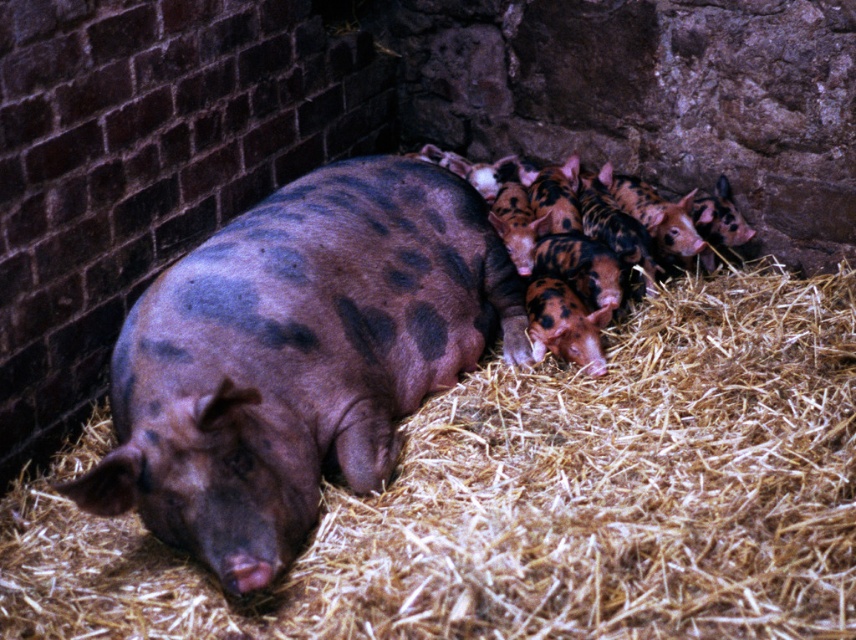
Does brown straw at center lie behind speckled brown pig at center?

No, brown straw at center is in front of speckled brown pig at center.

Who is higher up, brown straw at center or speckled brown pig at center?

speckled brown pig at center

Locate an element on the screen. This screenshot has width=856, height=640. brown straw at center is located at coordinates (535, 499).